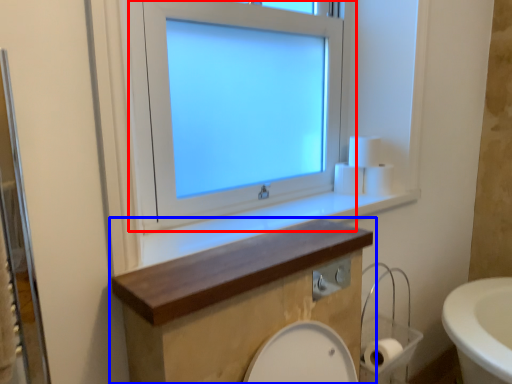
Question: Which of the following is the farthest to the observer, window (highlighted by a red box) or bathroom cabinet (highlighted by a blue box)?

Choices:
 (A) window
 (B) bathroom cabinet

Answer: (A)